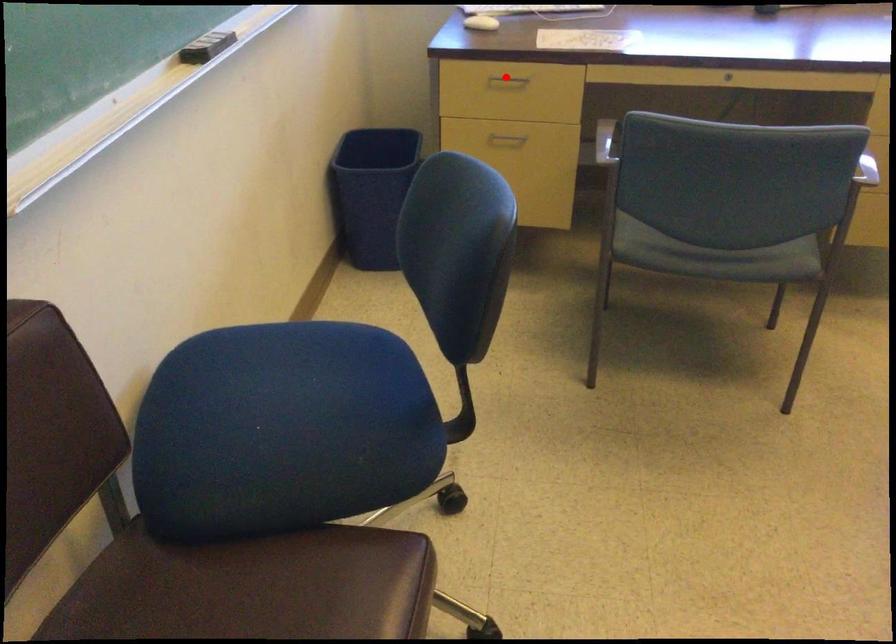
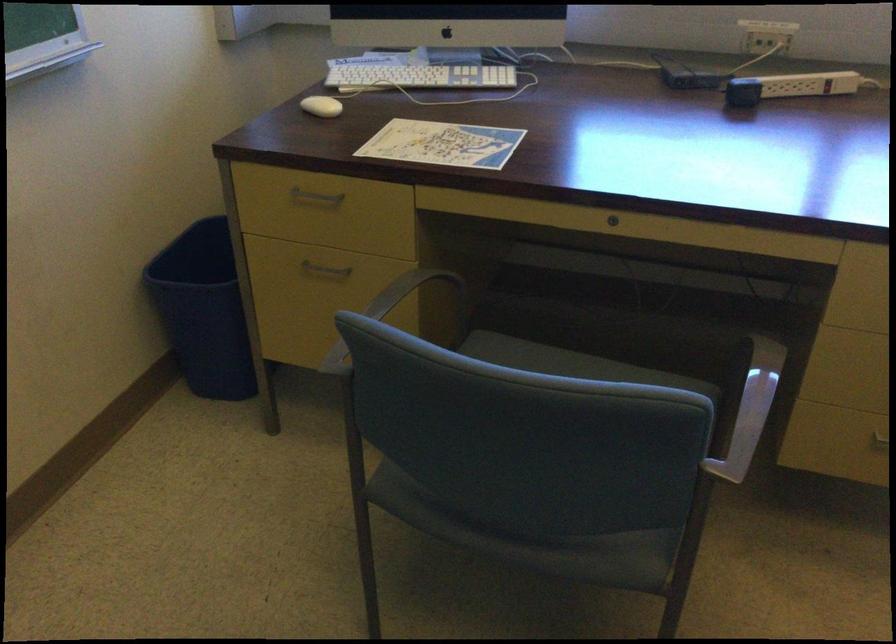
Question: I am providing you with two images of the same scene from different viewpoints. Given a red point in image1, look at the same physical point in image2. Is it:

Choices:
 (A) Closer to the viewpoint
 (B) Farther from the viewpoint

Answer: (A)